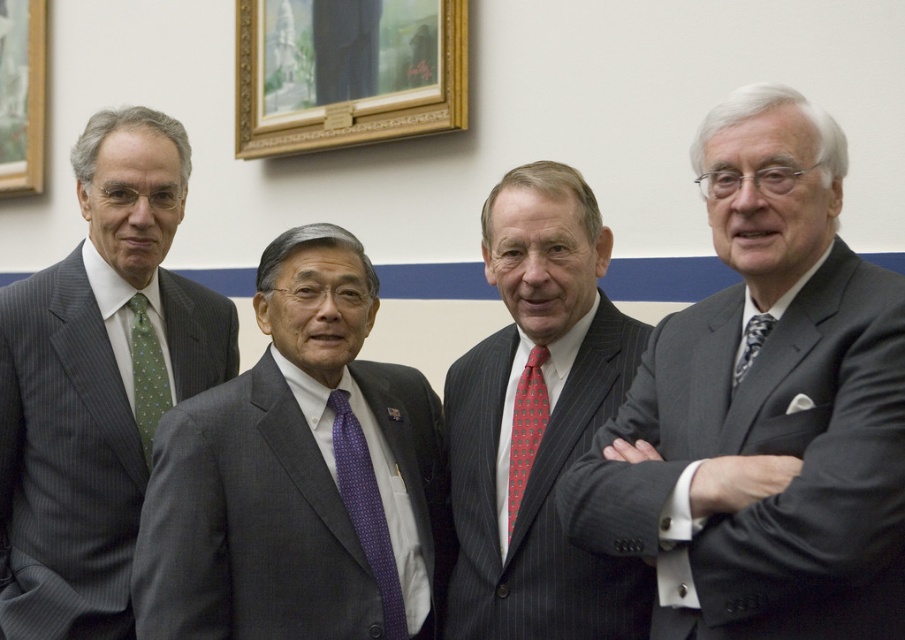
Based on the photo, you are a photographer adjusting the camera settings for a group photo. You notice the pinstriped suit at center and the red dotted tie at center. Which object should you focus on first to ensure proper exposure if the smaller object requires more detailed focus?

The red dotted tie at center requires more detailed focus because it is smaller than the pinstriped suit at center. Since smaller objects often need more precise focus adjustments, you should focus on the red dotted tie at center first to ensure proper exposure.